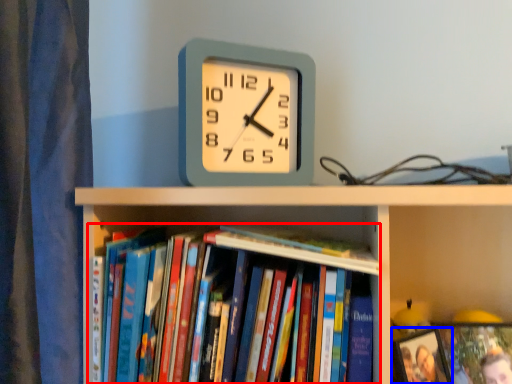
Question: Which point is closer to the camera, book (highlighted by a red box) or picture frame (highlighted by a blue box)?

Choices:
 (A) book
 (B) picture frame

Answer: (A)